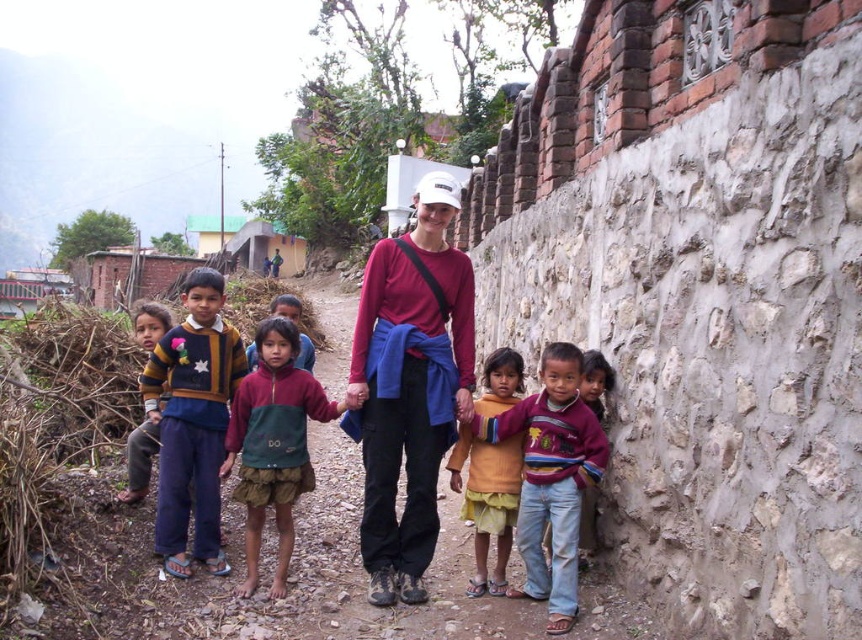
Between point (288, 536) and point (255, 349), which one is positioned behind?

The point (255, 349) is behind.

Which is more to the right, green fabric skirt at center or green fabric dress at center?

green fabric skirt at center is more to the right.

Between point (261, 444) and point (304, 346), which one is positioned behind?

The point (304, 346) is more distant.

Identify the location of green fabric skirt at center. (273, 444).

Is matte red shirt at center thinner than green fabric skirt at center?

Yes.

Is point (438, 310) positioned behind point (282, 474)?

That is True.

This screenshot has width=862, height=640. I want to click on matte red shirt at center, so click(x=409, y=387).

Is multicolored sweater at center to the left of striped sweater at lower right from the viewer's perspective?

Indeed, multicolored sweater at center is positioned on the left side of striped sweater at lower right.

Where is `multicolored sweater at center`? multicolored sweater at center is located at coordinates (404, 403).